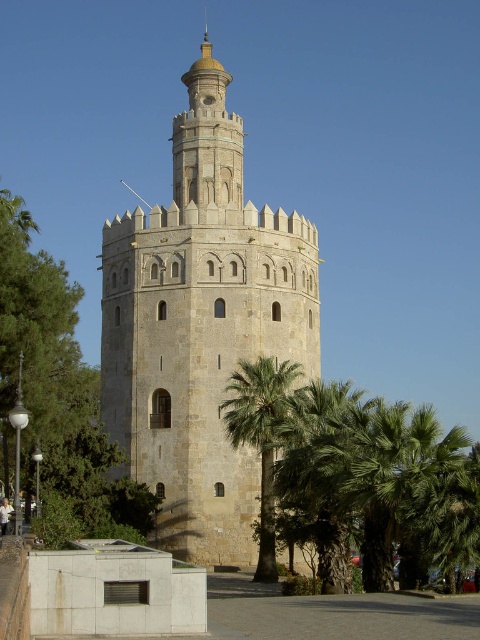
Does beige stone tower at center appear over green leafy palm at center?

Yes, beige stone tower at center is above green leafy palm at center.

Can you confirm if beige stone tower at center is wider than green leafy palm at center?

Incorrect, beige stone tower at center's width does not surpass green leafy palm at center's.

Who is more forward, (226, 77) or (311, 474)?

Point (311, 474) is more forward.

The image size is (480, 640). I want to click on beige stone tower at center, so click(x=201, y=324).

Which of these two, beige stone tower at center or green leafy tree at left, stands taller?

Standing taller between the two is beige stone tower at center.

Can you confirm if beige stone tower at center is thinner than green leafy tree at left?

Yes, beige stone tower at center is thinner than green leafy tree at left.

Who is more forward, (296, 280) or (101, 506)?

Point (101, 506) is more forward.

The width and height of the screenshot is (480, 640). In order to click on beige stone tower at center in this screenshot , I will do `click(201, 324)`.

Does green leafy palm at center appear on the right side of green leafy palm tree at center?

Yes, green leafy palm at center is to the right of green leafy palm tree at center.

Is green leafy palm at center shorter than green leafy palm tree at center?

Correct, green leafy palm at center is not as tall as green leafy palm tree at center.

Locate an element on the screen. green leafy palm at center is located at coordinates (355, 474).